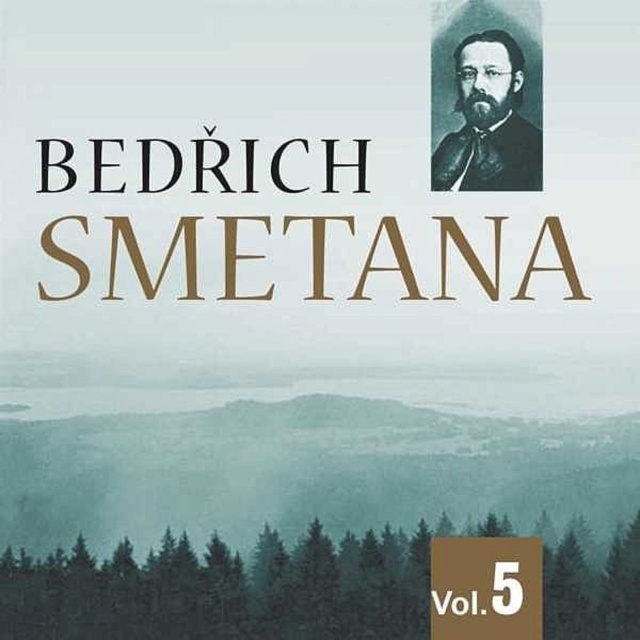
Question: Is gold metallic text at center to the left of black velvet portrait at upper right from the viewer's perspective?

Choices:
 (A) no
 (B) yes

Answer: (B)

Question: In this image, where is black serif text at upper center located relative to black velvet portrait at upper right?

Choices:
 (A) right
 (B) left

Answer: (B)

Question: Does gold metallic text at center have a larger size compared to black serif text at upper center?

Choices:
 (A) no
 (B) yes

Answer: (B)

Question: Which of the following is the closest to the observer?

Choices:
 (A) gold metallic text at center
 (B) black velvet portrait at upper right

Answer: (A)

Question: Which point is farther from the camera taking this photo?

Choices:
 (A) (355, 291)
 (B) (528, 180)

Answer: (B)

Question: Among these objects, which one is nearest to the camera?

Choices:
 (A) black velvet portrait at upper right
 (B) gold metallic text at center

Answer: (B)